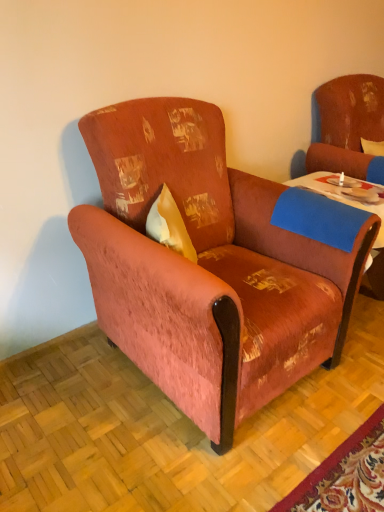
Question: Is blue felt table at center wider or thinner than distressed fabric swivel chair at upper right?

Choices:
 (A) wide
 (B) thin

Answer: (A)

Question: Is blue felt table at center situated inside distressed fabric swivel chair at upper right or outside?

Choices:
 (A) inside
 (B) outside

Answer: (B)

Question: Estimate the real-world distances between objects in this image. Which object is closer to the velvet-like rust-colored armchair at center?

Choices:
 (A) blue felt table at center
 (B) distressed fabric swivel chair at upper right

Answer: (A)

Question: Based on their relative distances, which object is farther from the velvet-like rust-colored armchair at center?

Choices:
 (A) blue felt table at center
 (B) distressed fabric swivel chair at upper right

Answer: (B)